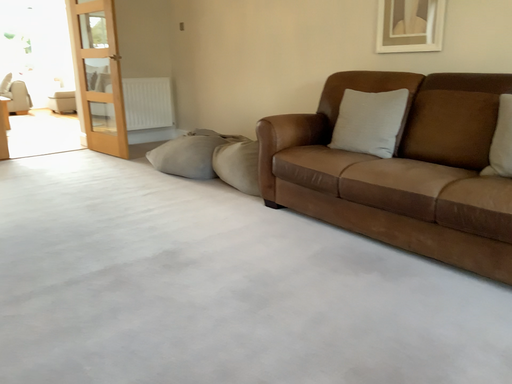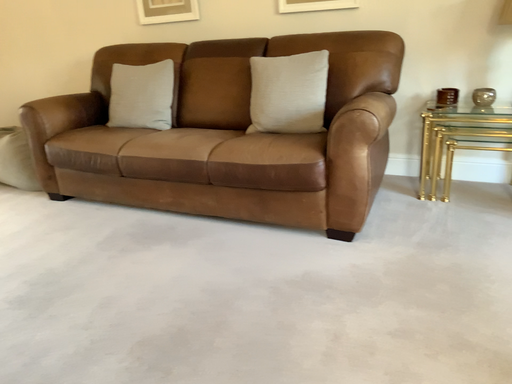
Question: How did the camera likely rotate when shooting the video?

Choices:
 (A) rotated left
 (B) rotated right

Answer: (B)